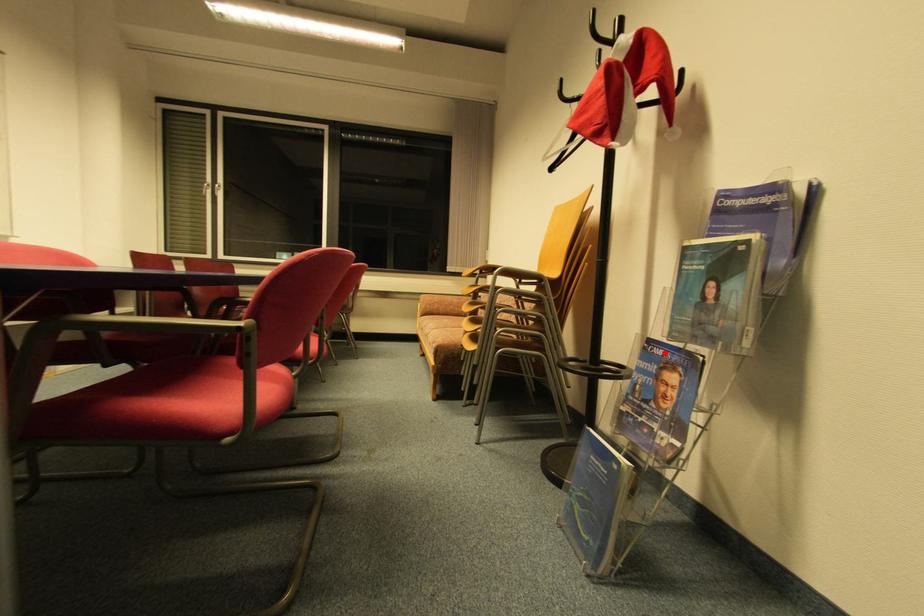
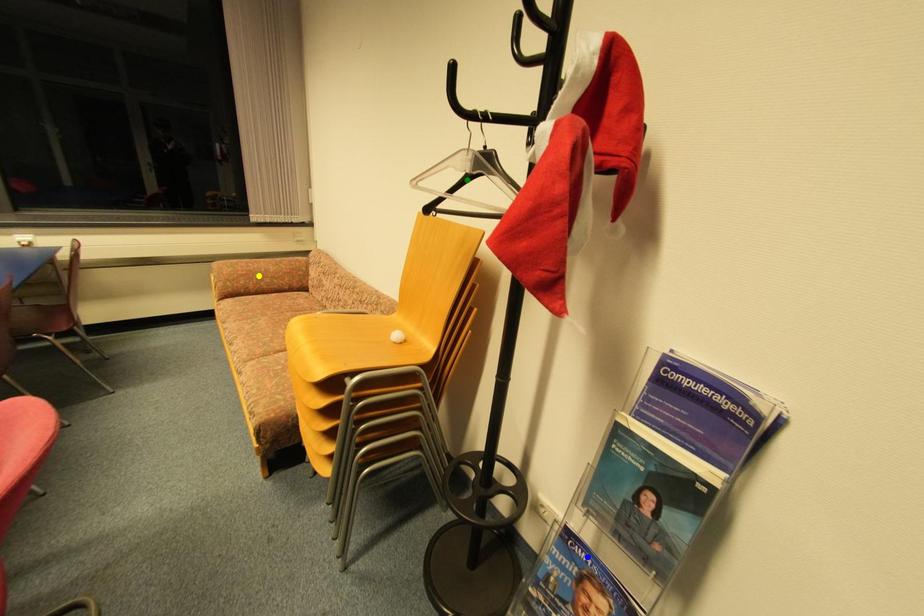
Question: I am providing you with two images of the same scene from different viewpoints. A red point is marked on the first image. You are given multiple points on the second image. Which spot in image 2 lines up with the point in image 1?

Choices:
 (A) yellow point
 (B) green point
 (C) blue point

Answer: (C)